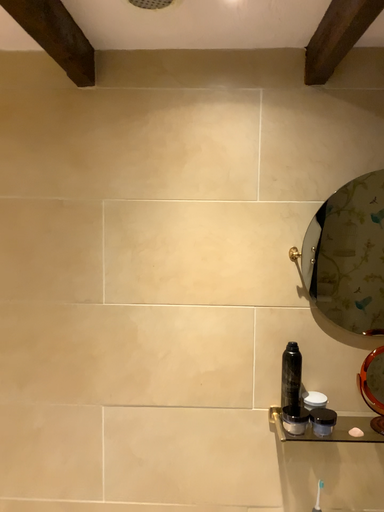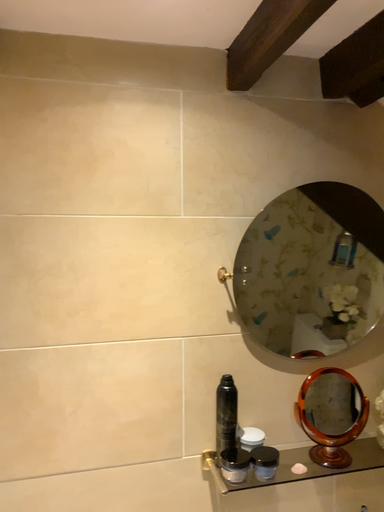
Question: How did the camera likely rotate when shooting the video?

Choices:
 (A) rotated left
 (B) rotated right

Answer: (B)